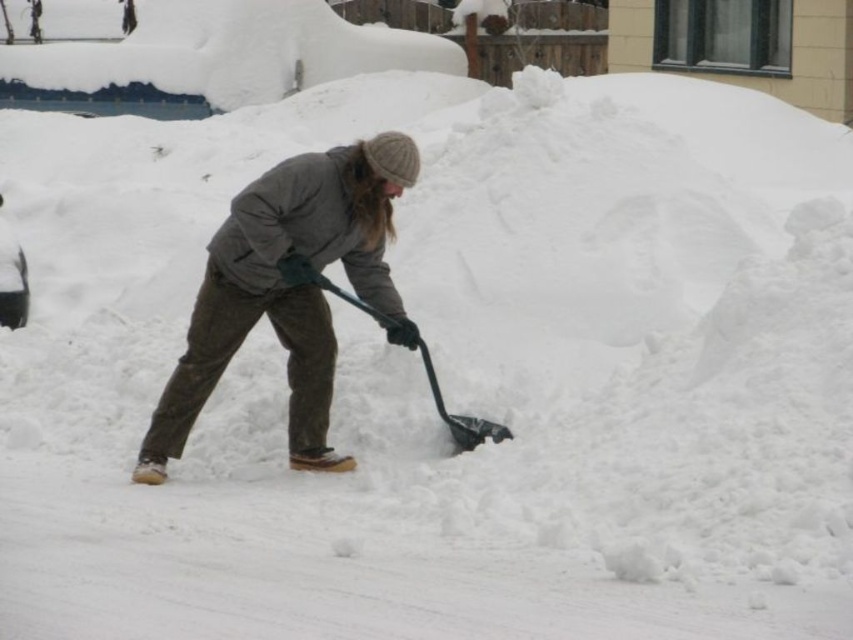
Question: Is dark gray woolen jacket at center positioned behind black plastic shovel at center?

Choices:
 (A) yes
 (B) no

Answer: (B)

Question: Is dark gray woolen jacket at center above black plastic shovel at center?

Choices:
 (A) yes
 (B) no

Answer: (A)

Question: Which object appears farthest from the camera in this image?

Choices:
 (A) black plastic shovel at center
 (B) dark gray woolen jacket at center

Answer: (A)

Question: Which point is farther from the camera taking this photo?

Choices:
 (A) [x=210, y=291]
 (B) [x=437, y=396]

Answer: (B)

Question: Is dark gray woolen jacket at center positioned at the back of black plastic shovel at center?

Choices:
 (A) yes
 (B) no

Answer: (B)

Question: Which object appears farthest from the camera in this image?

Choices:
 (A) dark gray woolen jacket at center
 (B) black plastic shovel at center

Answer: (B)